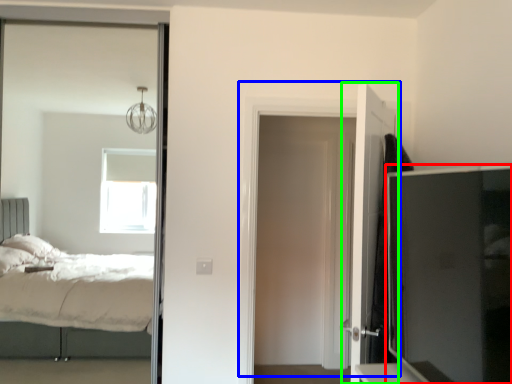
Question: Which object is positioned closest to tv cabinet (highlighted by a red box)? Select from door (highlighted by a blue box) and door (highlighted by a green box).

Choices:
 (A) door
 (B) door

Answer: (B)